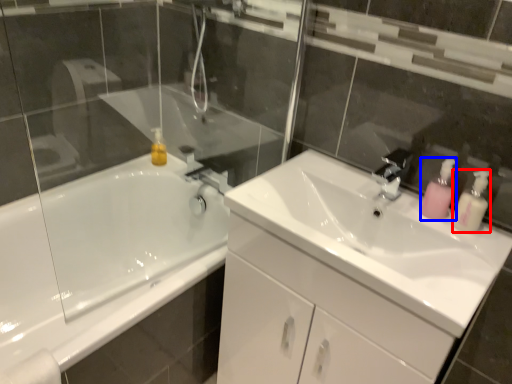
Question: Which object appears farthest to the camera in this image, soap dispenser (highlighted by a red box) or soap dispenser (highlighted by a blue box)?

Choices:
 (A) soap dispenser
 (B) soap dispenser

Answer: (B)